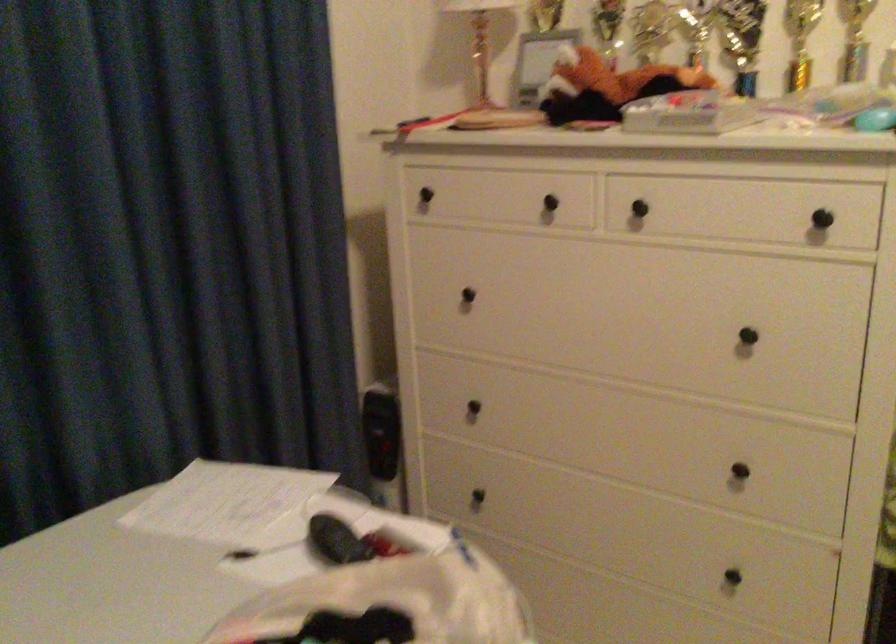
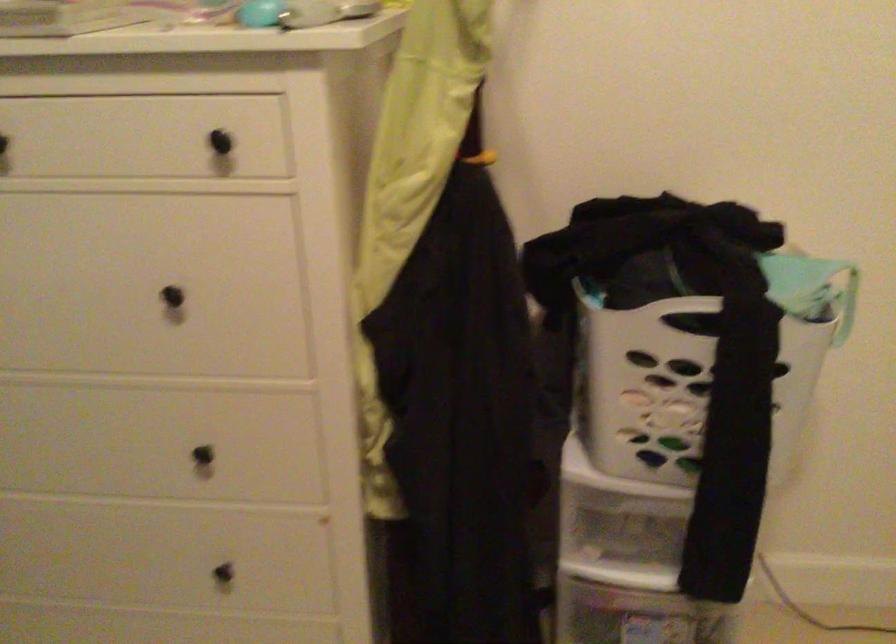
Question: The images are taken continuously from a first-person perspective. In which direction is your viewpoint rotating?

Choices:
 (A) Left
 (B) Right
 (C) Up
 (D) Down

Answer: (B)